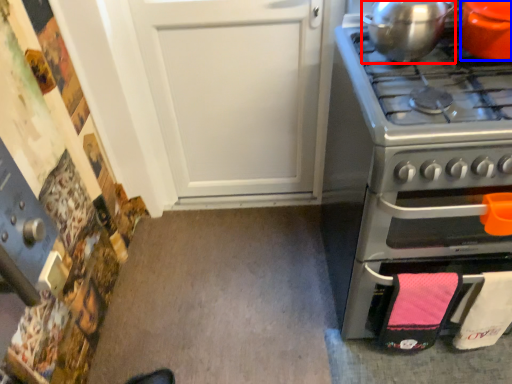
Question: Which object appears closest to the camera in this image, kitchen appliance (highlighted by a red box) or kitchen appliance (highlighted by a blue box)?

Choices:
 (A) kitchen appliance
 (B) kitchen appliance

Answer: (B)